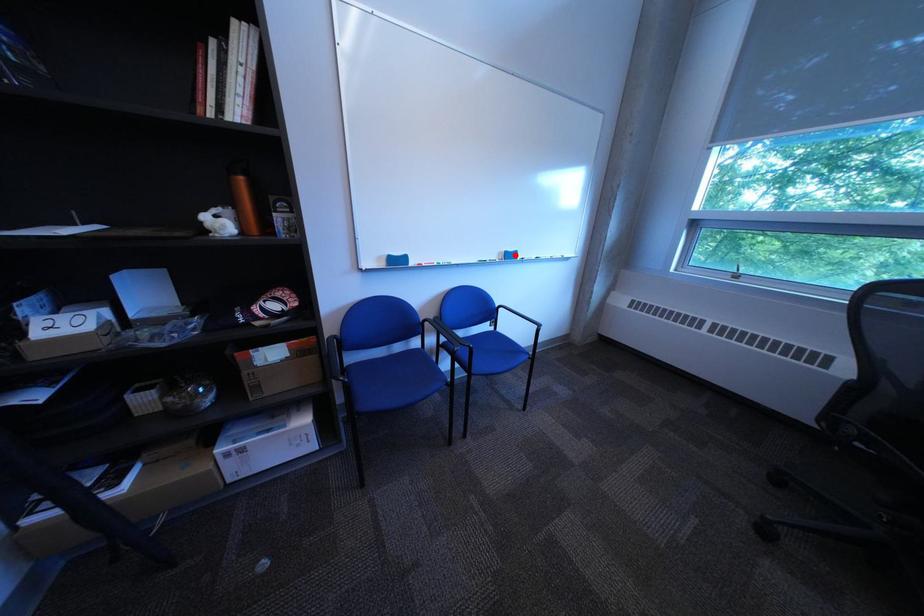
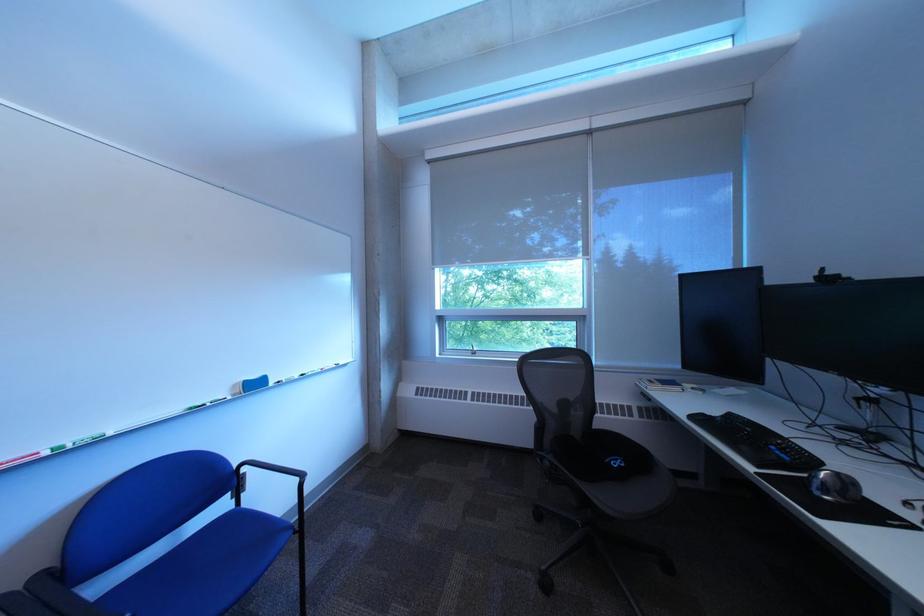
In the second image, find the point that corresponds to the highlighted location in the first image.

(249, 387)